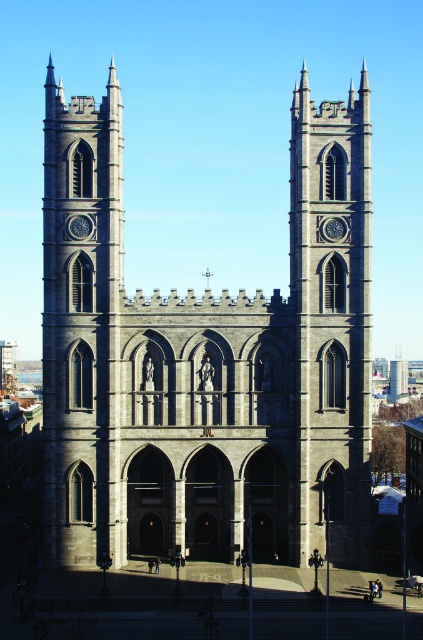
Question: Considering the relative positions of gray stone church at center and gray stone clock tower at center in the image provided, where is gray stone church at center located with respect to gray stone clock tower at center?

Choices:
 (A) right
 (B) left

Answer: (B)

Question: Does gray stone church at center have a larger size compared to gray stone clock tower at center?

Choices:
 (A) yes
 (B) no

Answer: (A)

Question: Is gray stone church at center to the right of gray stone clock tower at center from the viewer's perspective?

Choices:
 (A) yes
 (B) no

Answer: (B)

Question: Which point is closer to the camera taking this photo?

Choices:
 (A) (302, 198)
 (B) (87, 541)

Answer: (B)